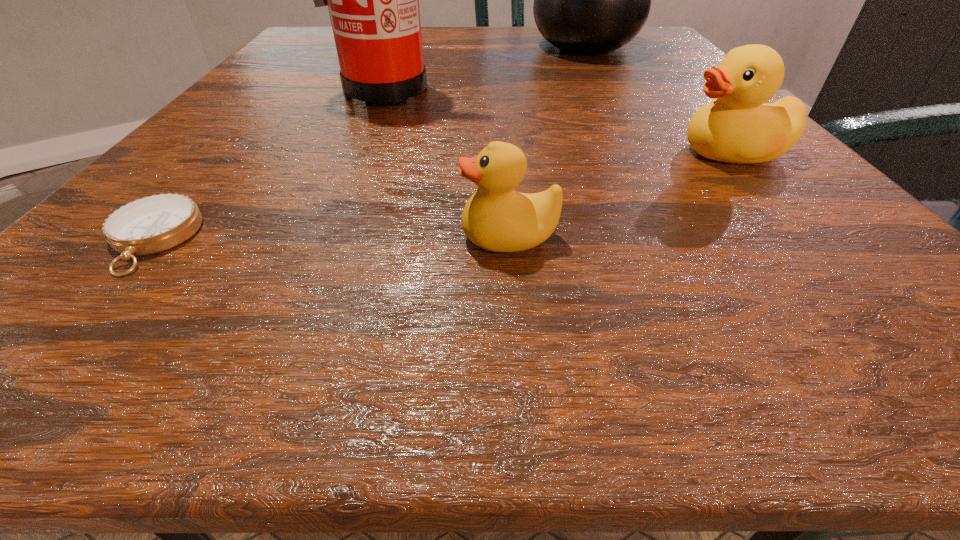
I want to click on free space located 0.400m on the label side of the fire extinguisher, so click(x=296, y=286).

You are a GUI agent. You are given a task and a screenshot of the screen. Output one action in this format:
    pyautogui.click(x=<x>, y=<y>)
    Task: Click on the vacant space located on the left of the second tallest object
    The height and width of the screenshot is (540, 960).
    Given the screenshot: What is the action you would take?
    pyautogui.click(x=502, y=46)

Where is `free location located 0.340m at the beak of the taller duck`? This screenshot has width=960, height=540. free location located 0.340m at the beak of the taller duck is located at coordinates (419, 152).

Find the location of a particular element. free space located 0.260m at the beak of the taller duck is located at coordinates (479, 152).

Identify the location of vacant area located 0.110m at the beak of the taller duck. (593, 152).

Find the location of a particular element. free space located at the beak of the left duck is located at coordinates (176, 237).

Find the location of a particular element. This screenshot has width=960, height=540. vacant area situated at the beak of the left duck is located at coordinates (333, 237).

The width and height of the screenshot is (960, 540). What are the coordinates of `free location located at the beak of the left duck` in the screenshot? It's located at (126, 237).

In order to click on free space located on the back of the compass in this screenshot , I will do `click(243, 135)`.

What are the coordinates of `object that is at the far edge` in the screenshot? It's located at (590, 0).